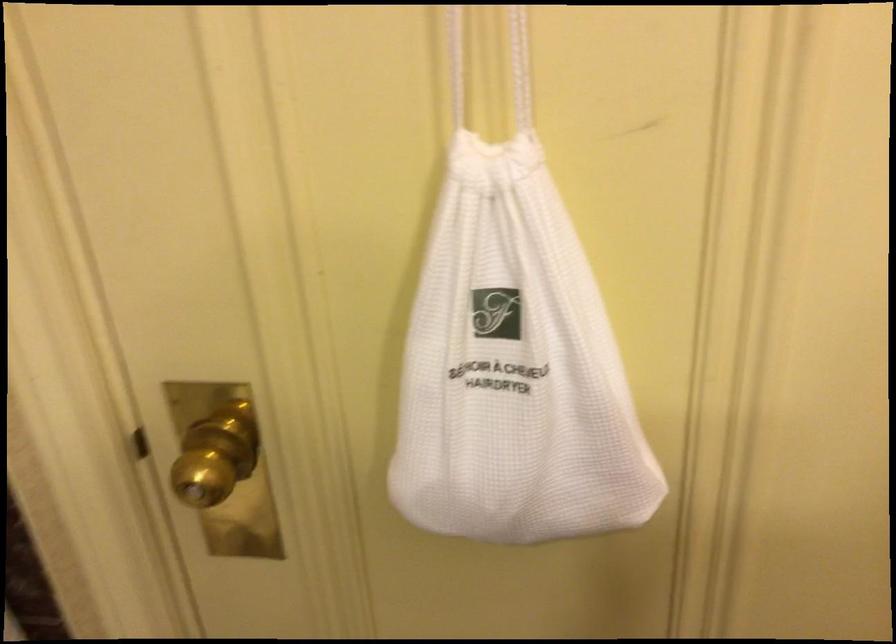
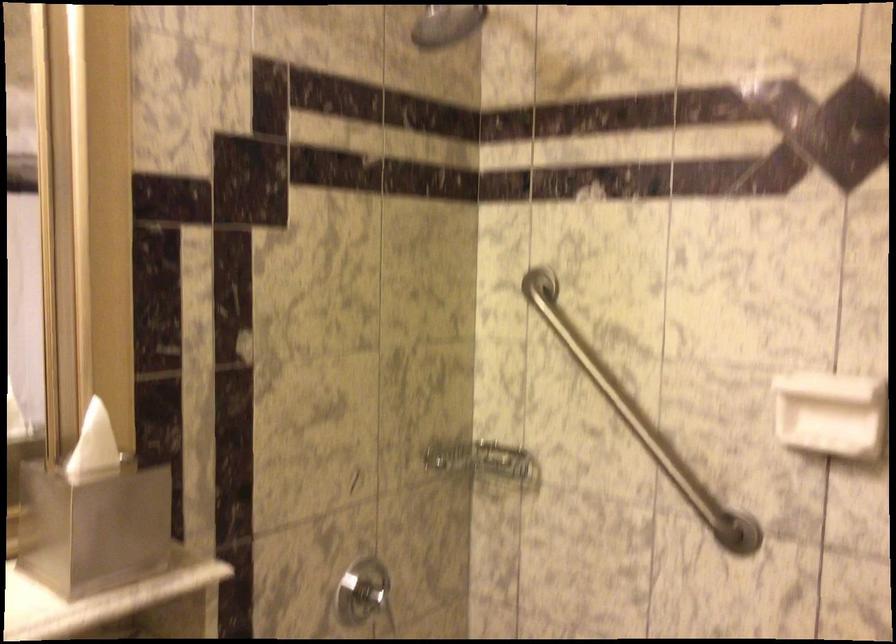
First-person continuous shooting, in which direction is the camera rotating?

The rotation direction of the camera is left-down.